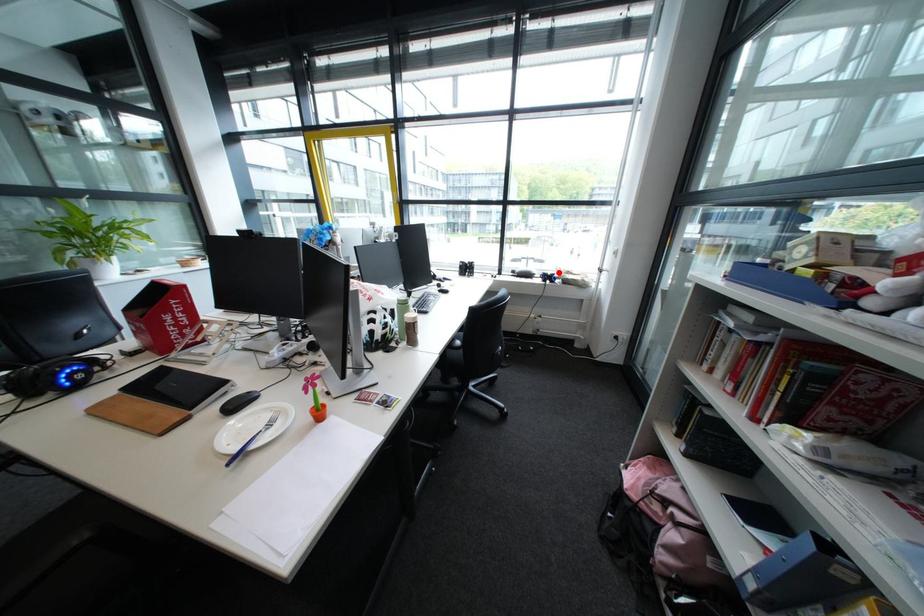
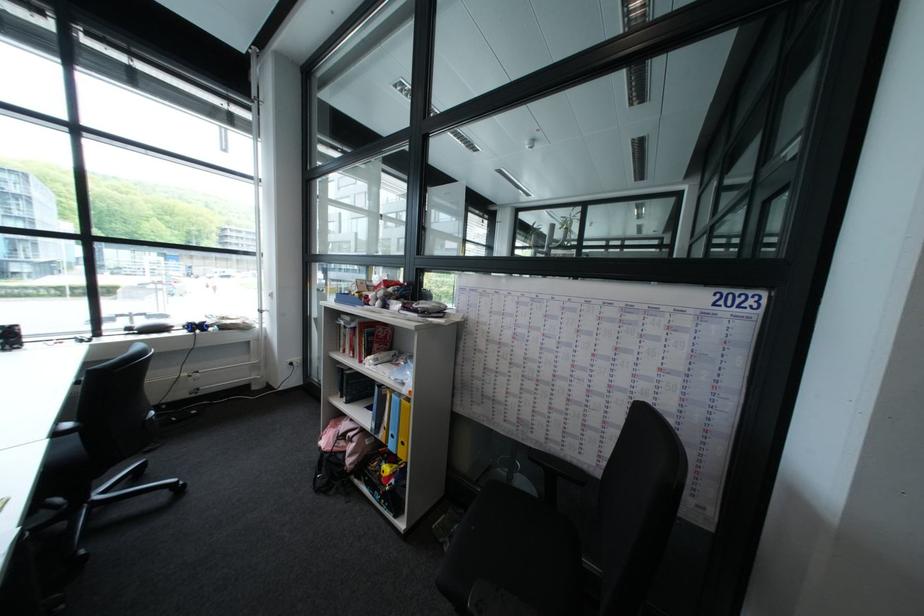
Question: A red point is marked in image1. In image2, is the corresponding 3D point closer to the camera or farther? Reply with the corresponding letter.

Choices:
 (A) The corresponding 3D point is closer.
 (B) The corresponding 3D point is farther.

Answer: (B)